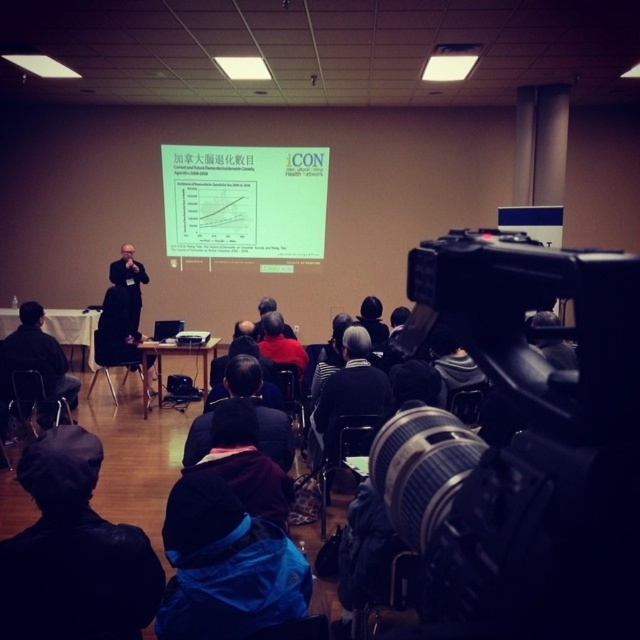
In the scene shown: You are an event organizer who needs to know the relative sizes of the white paper at center and the dark gray suit at left for seating arrangements. Which object is bigger?

The white paper at center is larger in size than the dark gray suit at left.

You are attending a conference and want to position yourself between the two points labeled point (212,200) and point (221,440). Based on their positions, which point is farther away from the speaker at the front of the room?

Point (212,200) is behind point (221,440), so it is farther away from the speaker at the front of the room.

You are an event organizer and need to ensure that the white paper at center and the dark gray suit at left are visible in the video feed. Based on their positions, will both objects be captured in the camera frame?

The white paper at center is located above the dark gray suit at left, so both objects will be captured in the camera frame since they are positioned within the camera angle.